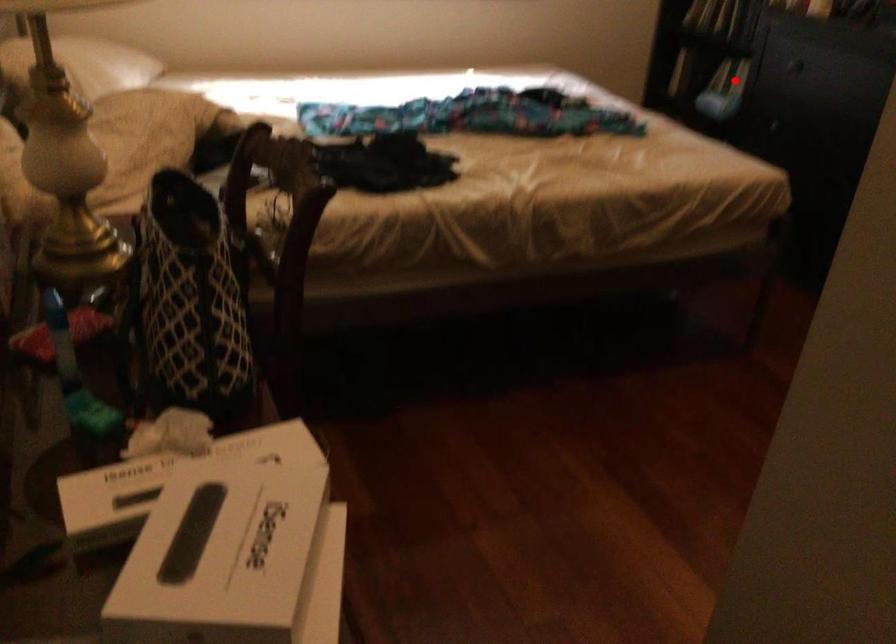
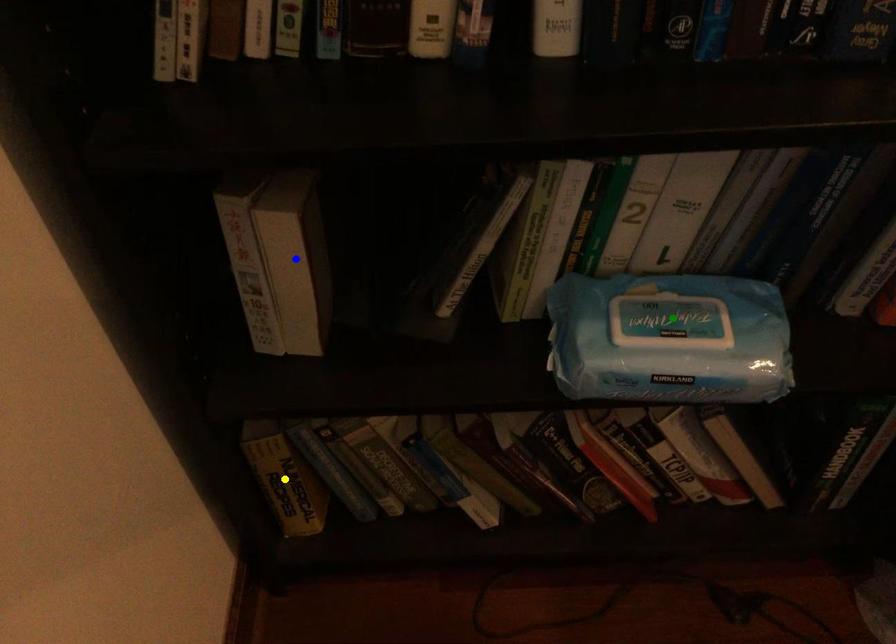
Question: I am providing you with two images of the same scene from different viewpoints. A red point is marked on the first image. You are given multiple points on the second image. Which point in image 2 represents the same 3d spot as the red point in image 1?

Choices:
 (A) yellow point
 (B) green point
 (C) blue point

Answer: (B)